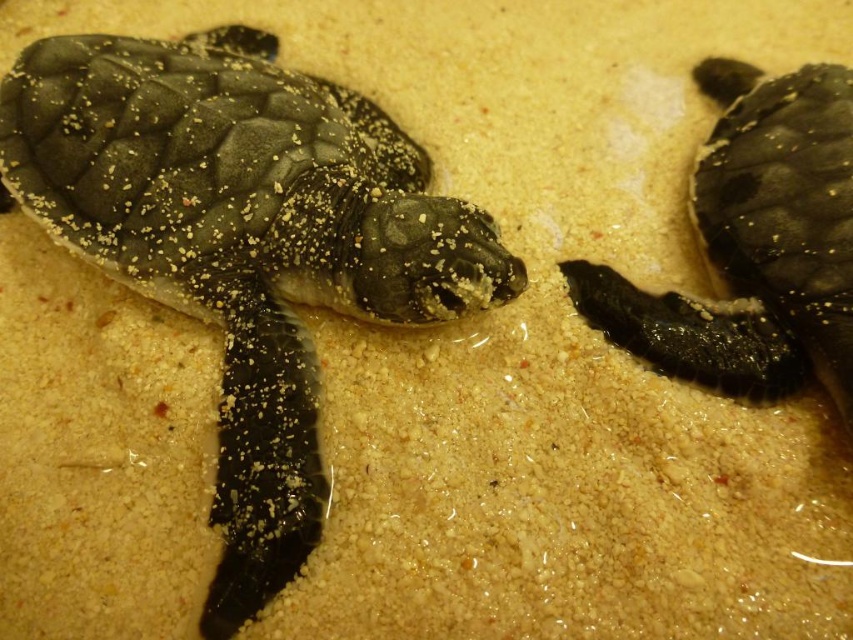
Between point (247, 256) and point (750, 141), which one is positioned in front?

Positioned in front is point (247, 256).

This screenshot has height=640, width=853. What do you see at coordinates (242, 243) in the screenshot?
I see `shiny black turtle at center` at bounding box center [242, 243].

What are the coordinates of `shiny black turtle at center` in the screenshot? It's located at (242, 243).